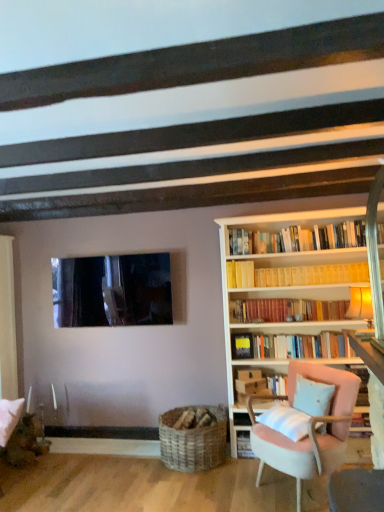
Question: Can you confirm if woven wood basket at lower center is positioned to the left of hardcover books at center, acting as the second book starting from the top?

Choices:
 (A) yes
 (B) no

Answer: (A)

Question: Does woven wood basket at lower center have a greater width compared to hardcover books at center, acting as the second book starting from the top?

Choices:
 (A) yes
 (B) no

Answer: (A)

Question: From a real-world perspective, does woven wood basket at lower center sit lower than hardcover books at center, acting as the second book starting from the top?

Choices:
 (A) no
 (B) yes

Answer: (B)

Question: Is hardcover books at center, placed as the first book when sorted from bottom to top, completely or partially inside woven wood basket at lower center?

Choices:
 (A) no
 (B) yes

Answer: (A)

Question: Considering the relative positions of woven wood basket at lower center and hardcover books at center, placed as the first book when sorted from bottom to top, in the image provided, is woven wood basket at lower center behind hardcover books at center, placed as the first book when sorted from bottom to top,?

Choices:
 (A) no
 (B) yes

Answer: (A)

Question: Does point (304, 276) appear closer or farther from the camera than point (345, 337)?

Choices:
 (A) farther
 (B) closer

Answer: (A)

Question: Is yellow paperbacks at upper center, the 2th book ordered from the bottom, taller or shorter than hardcover books at center, placed as the first book when sorted from bottom to top?

Choices:
 (A) short
 (B) tall

Answer: (A)

Question: From a real-world perspective, is yellow paperbacks at upper center, acting as the first book starting from the top, above or below hardcover books at center, placed as the first book when sorted from bottom to top?

Choices:
 (A) above
 (B) below

Answer: (A)

Question: From the image's perspective, relative to hardcover books at center, placed as the first book when sorted from bottom to top, is yellow paperbacks at upper center, acting as the first book starting from the top, above or below?

Choices:
 (A) above
 (B) below

Answer: (A)

Question: Is light blue fabric pillow at lower right taller or shorter than yellow paperbacks at upper center, acting as the first book starting from the top?

Choices:
 (A) short
 (B) tall

Answer: (B)

Question: Considering their positions, is light blue fabric pillow at lower right located in front of or behind yellow paperbacks at upper center, acting as the first book starting from the top?

Choices:
 (A) front
 (B) behind

Answer: (A)

Question: Considering the positions of point (317, 407) and point (354, 265), is point (317, 407) closer or farther from the camera than point (354, 265)?

Choices:
 (A) farther
 (B) closer

Answer: (B)

Question: Is light blue fabric pillow at lower right spatially inside yellow paperbacks at upper center, acting as the first book starting from the top, or outside of it?

Choices:
 (A) inside
 (B) outside

Answer: (B)

Question: From the image's perspective, is yellow paperbacks at upper center, the 2th book ordered from the bottom, located above or below pink fabric chair at right?

Choices:
 (A) below
 (B) above

Answer: (B)

Question: Based on their sizes in the image, would you say yellow paperbacks at upper center, the 2th book ordered from the bottom, is bigger or smaller than pink fabric chair at right?

Choices:
 (A) big
 (B) small

Answer: (B)